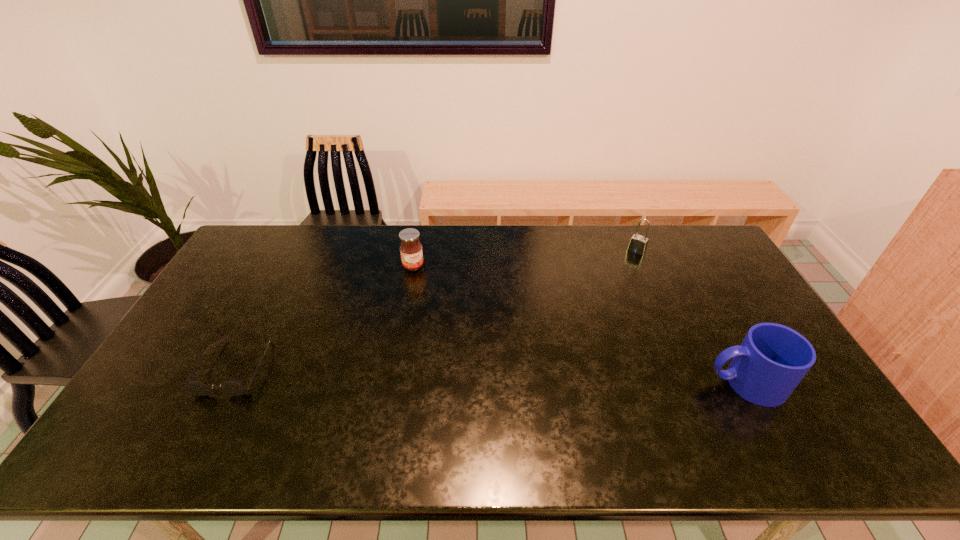
The height and width of the screenshot is (540, 960). I want to click on blank area in the image that satisfies the following two spatial constraints: 1. on the front-facing side of the leftmost object; 2. on the side with the handle of the mug, so click(227, 383).

Locate an element on the screen. This screenshot has width=960, height=540. vacant space that satisfies the following two spatial constraints: 1. on the front-facing side of the sunglasses; 2. on the side with the handle of the mug is located at coordinates (227, 383).

I want to click on blank area in the image that satisfies the following two spatial constraints: 1. on the front-facing side of the mug; 2. on the side with the handle of the sunglasses, so click(227, 383).

At what (x,y) coordinates should I click in order to perform the action: click on vacant space that satisfies the following two spatial constraints: 1. on the front side of the third object from right to left; 2. on the side with the handle of the mug. Please return your answer as a coordinate pair (x, y). The image size is (960, 540). Looking at the image, I should click on (393, 383).

What are the coordinates of `free space that satisfies the following two spatial constraints: 1. on the front-facing side of the mug; 2. on the side with the handle of the leftmost object` in the screenshot? It's located at point(227,383).

Where is `free location that satisfies the following two spatial constraints: 1. on the front-facing side of the mug; 2. on the side with the handle of the leftmost object`? The height and width of the screenshot is (540, 960). free location that satisfies the following two spatial constraints: 1. on the front-facing side of the mug; 2. on the side with the handle of the leftmost object is located at coordinates (227, 383).